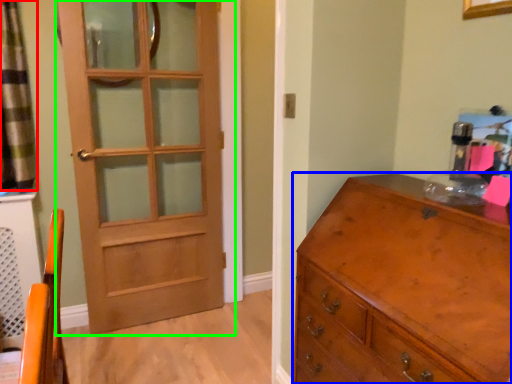
Question: Which is nearer to the curtain (highlighted by a red box)? chest of drawers (highlighted by a blue box) or door (highlighted by a green box).

Choices:
 (A) chest of drawers
 (B) door

Answer: (B)